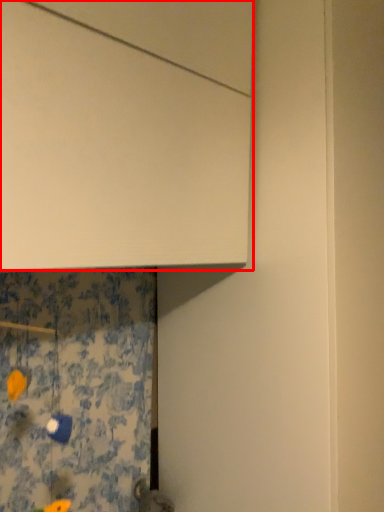
Question: From the image's perspective, what is the correct spatial positioning of cabinetry (annotated by the red box) in reference to shower curtain?

Choices:
 (A) below
 (B) above

Answer: (B)